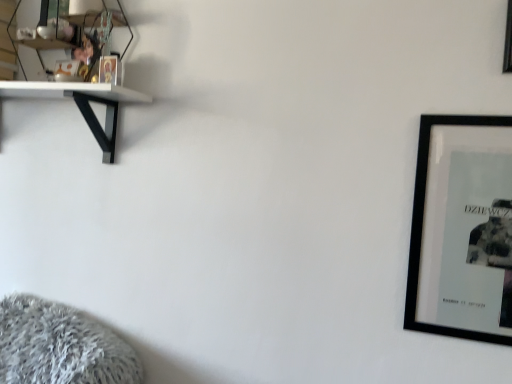
Question: Is black matte picture frame at upper right, acting as the second picture frame starting from the bottom, surrounded by black matte picture frame at right, the second picture frame viewed from the top?

Choices:
 (A) no
 (B) yes

Answer: (A)

Question: Does black matte picture frame at right, the second picture frame viewed from the top, lie in front of black matte picture frame at upper right, acting as the second picture frame starting from the bottom?

Choices:
 (A) yes
 (B) no

Answer: (B)

Question: Is black matte picture frame at right, the second picture frame viewed from the top, facing towards black matte picture frame at upper right, which is the 1th picture frame in top-to-bottom order?

Choices:
 (A) no
 (B) yes

Answer: (A)

Question: From the image's perspective, is black matte picture frame at right, the second picture frame viewed from the top, beneath black matte picture frame at upper right, which is the 1th picture frame in top-to-bottom order?

Choices:
 (A) yes
 (B) no

Answer: (A)

Question: From the image's perspective, is black matte picture frame at right, the second picture frame viewed from the top, on top of black matte picture frame at upper right, which is the 1th picture frame in top-to-bottom order?

Choices:
 (A) no
 (B) yes

Answer: (A)

Question: Visually, is black matte picture frame at right, the second picture frame viewed from the top, positioned to the left or to the right of black matte picture frame at upper right, acting as the second picture frame starting from the bottom?

Choices:
 (A) left
 (B) right

Answer: (A)

Question: Is black matte picture frame at right, the second picture frame viewed from the top, in front of or behind black matte picture frame at upper right, which is the 1th picture frame in top-to-bottom order, in the image?

Choices:
 (A) behind
 (B) front

Answer: (A)

Question: From a real-world perspective, relative to black matte picture frame at upper right, acting as the second picture frame starting from the bottom, is black matte picture frame at right, the second picture frame viewed from the top, vertically above or below?

Choices:
 (A) below
 (B) above

Answer: (A)

Question: Based on their sizes in the image, would you say black matte picture frame at right, the second picture frame viewed from the top, is bigger or smaller than black matte picture frame at upper right, acting as the second picture frame starting from the bottom?

Choices:
 (A) small
 (B) big

Answer: (B)

Question: From the image's perspective, relative to black matte picture frame at upper right, acting as the second picture frame starting from the bottom, is clear glass shelf at upper left above or below?

Choices:
 (A) below
 (B) above

Answer: (B)

Question: In the image, is clear glass shelf at upper left on the left side or the right side of black matte picture frame at upper right, acting as the second picture frame starting from the bottom?

Choices:
 (A) right
 (B) left

Answer: (B)

Question: Does point (115, 36) appear closer or farther from the camera than point (505, 44)?

Choices:
 (A) closer
 (B) farther

Answer: (B)

Question: Is clear glass shelf at upper left bigger or smaller than black matte picture frame at upper right, acting as the second picture frame starting from the bottom?

Choices:
 (A) small
 (B) big

Answer: (B)

Question: In terms of height, does black matte picture frame at upper right, acting as the second picture frame starting from the bottom, look taller or shorter compared to clear glass shelf at upper left?

Choices:
 (A) short
 (B) tall

Answer: (A)

Question: Do you think black matte picture frame at upper right, acting as the second picture frame starting from the bottom, is within clear glass shelf at upper left, or outside of it?

Choices:
 (A) outside
 (B) inside

Answer: (A)